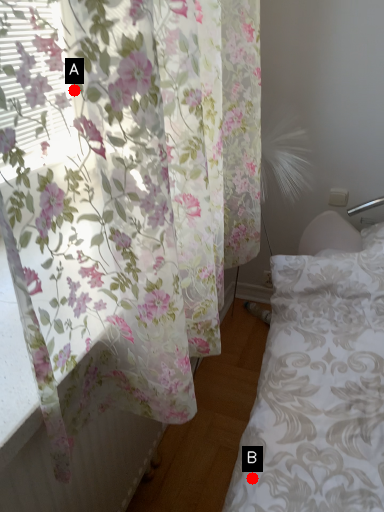
Question: Two points are circled on the image, labeled by A and B beside each circle. Which point is closer to the camera?

Choices:
 (A) A is closer
 (B) B is closer

Answer: (A)